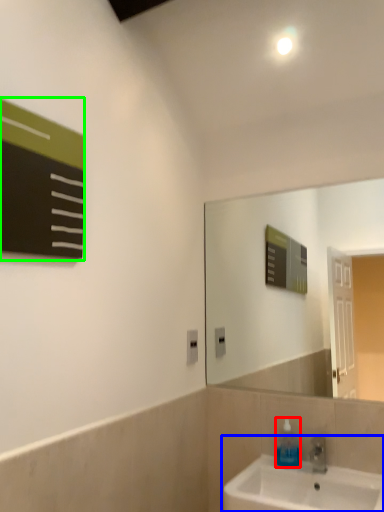
Question: Which object is the closest to the soap dispenser (highlighted by a red box)? Choose among these: sink (highlighted by a blue box) or bulletin board (highlighted by a green box).

Choices:
 (A) sink
 (B) bulletin board

Answer: (A)